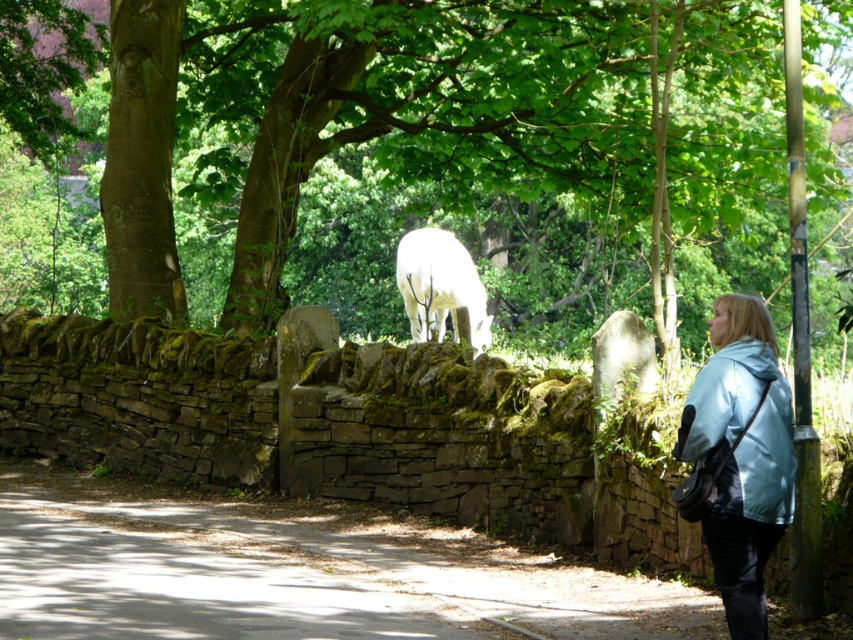
You are standing in front of the stone wall and want to take a photo of the green leafy tree at upper center. If your camera has a maximum zoom range of 100 feet, will you be able to capture the tree clearly without moving closer?

The green leafy tree at upper center is 38.78 feet away from camera, which is within the camera maximum zoom range of 100 feet. Therefore, you can capture the tree clearly without moving closer.

You are standing at the edge of the dirt path at lower center and want to approach the white woolly goat at center. Which direction should you move to reach the goat?

To reach the white woolly goat at center from the dirt path at lower center, you should move to the right since the dirt path is located to the left of the goat.

You are a hiker carrying a backpack and need to walk along the dirt path at lower center while avoiding the white woolly goat at center. Is the path wide enough for you to pass the goat safely?

The dirt path at lower center has a lesser width compared to white woolly goat at center, meaning the path is narrower than the goat. This suggests the path might be too narrow for safe passage, so it is advisable to find an alternative route or wait for the goat to move.